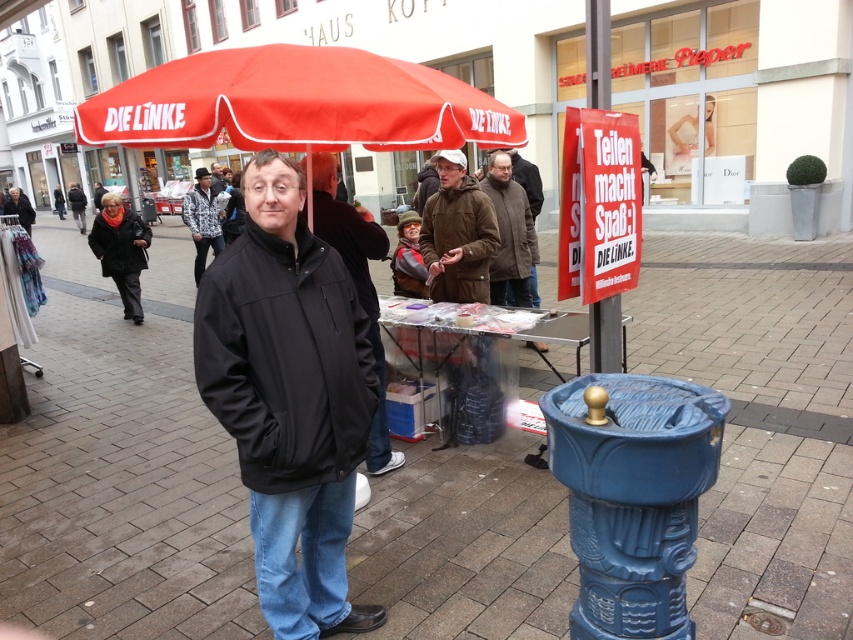
Question: Among these objects, which one is farthest from the camera?

Choices:
 (A) white printed jacket at center
 (B) brown woolen jacket at center
 (C) brown fuzzy jacket at center
 (D) black softshell jacket at center

Answer: (A)

Question: Which point appears farthest from the camera in this image?

Choices:
 (A) pos(190,224)
 (B) pos(320,112)
 (C) pos(82,220)
 (D) pos(209,332)

Answer: (C)

Question: Does red fabric umbrella at upper center appear on the left side of brown woolen jacket at center?

Choices:
 (A) no
 (B) yes

Answer: (B)

Question: Can you confirm if red plastic sign at center right is bigger than patterned fabric jacket at center?

Choices:
 (A) no
 (B) yes

Answer: (A)

Question: Which point is closer to the camera?

Choices:
 (A) brown fuzzy jacket at center
 (B) red plastic sign at center right

Answer: (B)

Question: Can you confirm if black softshell jacket at center is smaller than black matte jacket at left?

Choices:
 (A) no
 (B) yes

Answer: (B)